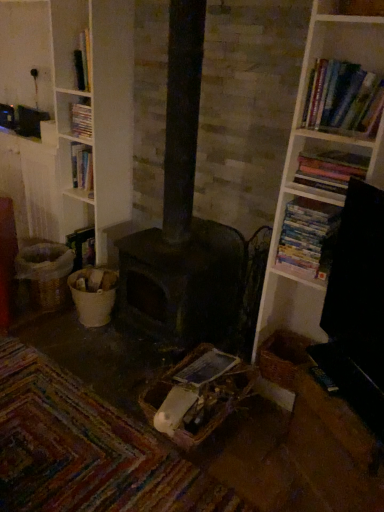
Question: From the image's perspective, would you say dark matte heater at center is shown under hardcover book at upper left, which is counted as the fourth book, starting from the front?

Choices:
 (A) yes
 (B) no

Answer: (A)

Question: Does dark matte heater at center turn towards hardcover book at upper left, which is counted as the fourth book, starting from the front?

Choices:
 (A) no
 (B) yes

Answer: (A)

Question: Can you confirm if dark matte heater at center is thinner than hardcover book at upper left, which ranks as the 4th book in right-to-left order?

Choices:
 (A) yes
 (B) no

Answer: (A)

Question: From the image's perspective, does dark matte heater at center appear higher than hardcover book at upper left, which is counted as the fourth book, starting from the front?

Choices:
 (A) yes
 (B) no

Answer: (B)

Question: Is dark matte heater at center wider than hardcover book at upper left, which is counted as the fourth book, starting from the front?

Choices:
 (A) yes
 (B) no

Answer: (B)

Question: Based on their positions, is hardcover books at upper right, which ranks as the first book in front-to-back order, located to the left or right of white paperbacks at right, arranged as the third book when viewed from the front?

Choices:
 (A) left
 (B) right

Answer: (B)

Question: Considering the positions of point (364, 74) and point (322, 225), is point (364, 74) closer or farther from the camera than point (322, 225)?

Choices:
 (A) farther
 (B) closer

Answer: (B)

Question: From the image's perspective, is hardcover books at upper right, marked as the 4th book in a left-to-right arrangement, positioned above or below white paperbacks at right, which is the 2th book in back-to-front order?

Choices:
 (A) above
 (B) below

Answer: (A)

Question: Considering the positions of hardcover books at upper right, which is counted as the first book, starting from the right, and white paperbacks at right, the third book in the right-to-left sequence, in the image, is hardcover books at upper right, which is counted as the first book, starting from the right, taller or shorter than white paperbacks at right, the third book in the right-to-left sequence,?

Choices:
 (A) tall
 (B) short

Answer: (B)

Question: Is point (350, 169) closer or farther from the camera than point (319, 122)?

Choices:
 (A) closer
 (B) farther

Answer: (B)

Question: Relative to hardcover books at upper right, which ranks as the first book in front-to-back order, is hardcover books at upper right, which is counted as the 3th book, starting from the back, in front or behind?

Choices:
 (A) behind
 (B) front

Answer: (A)

Question: Choose the correct answer: Is hardcover books at upper right, which is counted as the third book, starting from the left, inside hardcover books at upper right, the fourth book from the back, or outside it?

Choices:
 (A) outside
 (B) inside

Answer: (A)

Question: From a real-world perspective, relative to hardcover books at upper right, the fourth book from the back, is hardcover books at upper right, which appears as the second book when viewed from the front, vertically above or below?

Choices:
 (A) below
 (B) above

Answer: (A)

Question: Is white paperbacks at right, arranged as the second book when viewed from the left, bigger or smaller than hardcover books at upper right, the fourth book from the back?

Choices:
 (A) small
 (B) big

Answer: (A)

Question: Is white paperbacks at right, arranged as the second book when viewed from the left, spatially inside hardcover books at upper right, marked as the 4th book in a left-to-right arrangement, or outside of it?

Choices:
 (A) inside
 (B) outside

Answer: (B)